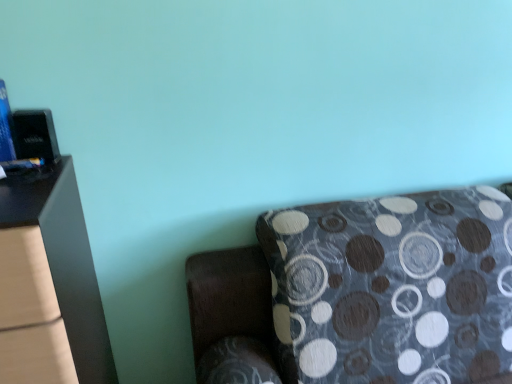
This screenshot has height=384, width=512. What do you see at coordinates (361, 294) in the screenshot?
I see `patterned fabric studio couch at lower right` at bounding box center [361, 294].

Identify the location of patterned fabric studio couch at lower right. (361, 294).

The width and height of the screenshot is (512, 384). I want to click on patterned fabric studio couch at lower right, so click(x=361, y=294).